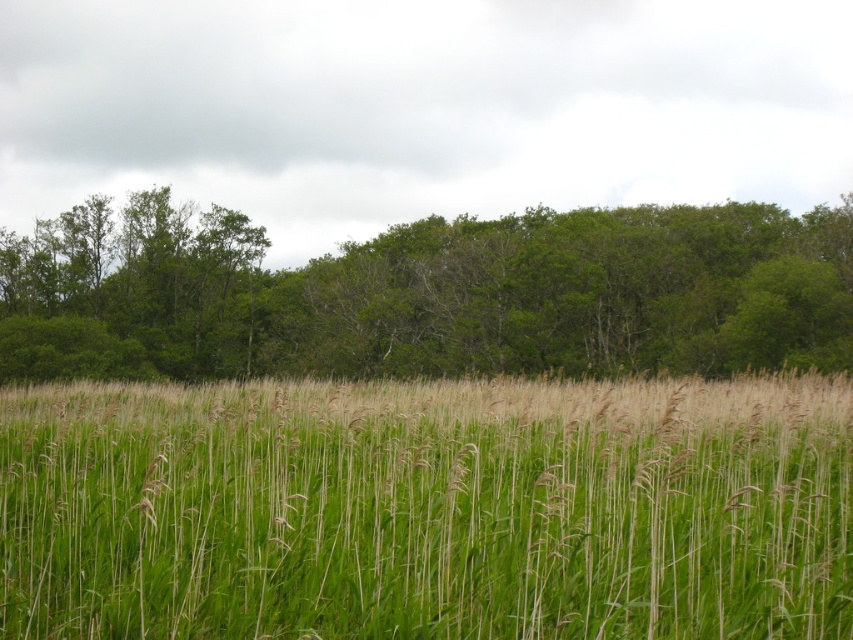
Is green grass at center to the left of green leafy trees at upper center from the viewer's perspective?

In fact, green grass at center is to the right of green leafy trees at upper center.

Which of these two, green grass at center or green leafy trees at upper center, stands taller?

green leafy trees at upper center is taller.

Describe the element at coordinates (427, 509) in the screenshot. I see `green grass at center` at that location.

This screenshot has width=853, height=640. What are the coordinates of `green grass at center` in the screenshot? It's located at (427, 509).